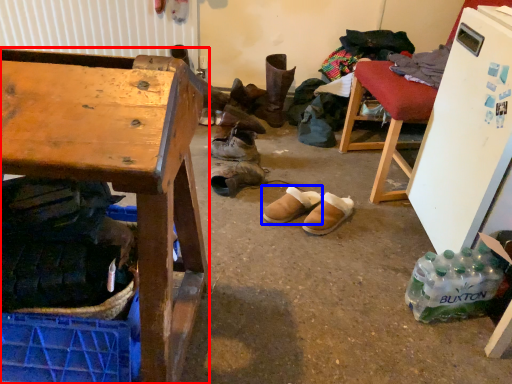
Question: Which object appears closest to the camera in this image, desk (highlighted by a red box) or footwear (highlighted by a blue box)?

Choices:
 (A) desk
 (B) footwear

Answer: (A)